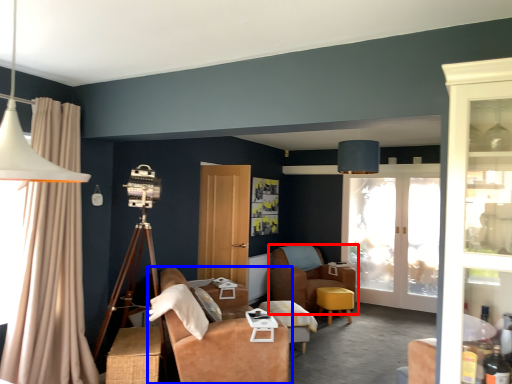
Question: Which of the following is the farthest to the observer, chair (highlighted by a red box) or studio couch (highlighted by a blue box)?

Choices:
 (A) chair
 (B) studio couch

Answer: (A)